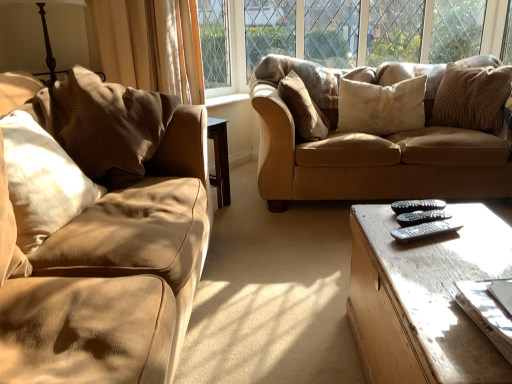
Question: Considering the relative positions of white corduroy pillow at upper right, the second pillow positioned from the right, and light brown wooden coffee table at lower right in the image provided, is white corduroy pillow at upper right, the second pillow positioned from the right, to the left of light brown wooden coffee table at lower right from the viewer's perspective?

Choices:
 (A) yes
 (B) no

Answer: (B)

Question: Is white corduroy pillow at upper right, the second pillow positioned from the right, taller than light brown wooden coffee table at lower right?

Choices:
 (A) no
 (B) yes

Answer: (A)

Question: Does white corduroy pillow at upper right, arranged as the fourth pillow when viewed from the left, lie behind light brown wooden coffee table at lower right?

Choices:
 (A) no
 (B) yes

Answer: (B)

Question: Could you tell me if white corduroy pillow at upper right, arranged as the fourth pillow when viewed from the left, is turned towards light brown wooden coffee table at lower right?

Choices:
 (A) no
 (B) yes

Answer: (B)

Question: From a real-world perspective, is white corduroy pillow at upper right, arranged as the fourth pillow when viewed from the left, located beneath light brown wooden coffee table at lower right?

Choices:
 (A) yes
 (B) no

Answer: (B)

Question: Is white corduroy pillow at upper right, arranged as the fourth pillow when viewed from the left, positioned with its back to light brown wooden coffee table at lower right?

Choices:
 (A) yes
 (B) no

Answer: (B)

Question: Is black plastic remote at center, arranged as the first remote when viewed from the back, positioned with its back to wooden table lamp at upper left?

Choices:
 (A) no
 (B) yes

Answer: (A)

Question: Is black plastic remote at center, arranged as the first remote when viewed from the back, bigger than wooden table lamp at upper left?

Choices:
 (A) yes
 (B) no

Answer: (B)

Question: Is black plastic remote at center, arranged as the first remote when viewed from the back, shorter than wooden table lamp at upper left?

Choices:
 (A) no
 (B) yes

Answer: (B)

Question: Does black plastic remote at center, arranged as the first remote when viewed from the back, have a smaller size compared to wooden table lamp at upper left?

Choices:
 (A) yes
 (B) no

Answer: (A)

Question: Can you confirm if black plastic remote at center, positioned as the third remote in front-to-back order, is positioned to the right of wooden table lamp at upper left?

Choices:
 (A) yes
 (B) no

Answer: (A)

Question: Considering the relative sizes of black plastic remote at center, positioned as the third remote in front-to-back order, and wooden table lamp at upper left in the image provided, is black plastic remote at center, positioned as the third remote in front-to-back order, wider than wooden table lamp at upper left?

Choices:
 (A) yes
 (B) no

Answer: (B)

Question: Is brown corduroy pillow at upper right, positioned as the fifth pillow in left-to-right order, facing towards black plastic remote at center, positioned as the third remote in front-to-back order?

Choices:
 (A) yes
 (B) no

Answer: (A)